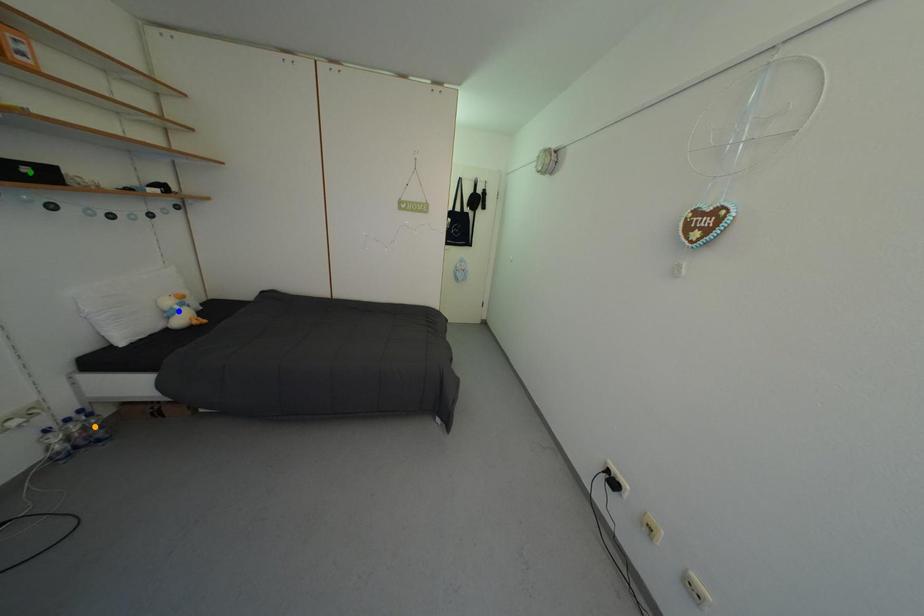
Order these from farthest to nearest:
- orange point
- blue point
- green point

blue point < orange point < green point